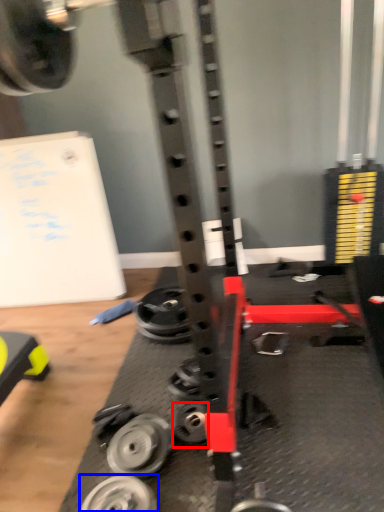
Question: Which object appears farthest to the camera in this image, wheel (highlighted by a red box) or wheel (highlighted by a blue box)?

Choices:
 (A) wheel
 (B) wheel

Answer: (A)